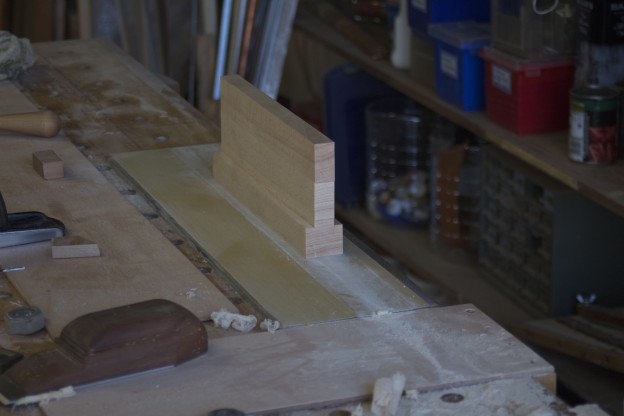
Find the location of a particular element. plastic lid is located at coordinates (356, 97).